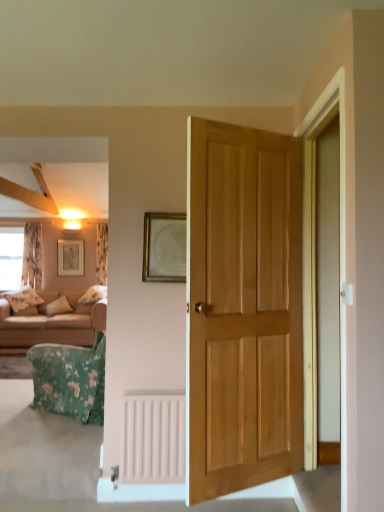
Question: Does matte gold picture frame at upper left, the second picture frame when ordered from right to left, touch beige fabric couch at left?

Choices:
 (A) yes
 (B) no

Answer: (B)

Question: Considering the relative sizes of matte gold picture frame at upper left, which ranks as the 1th picture frame in back-to-front order, and beige fabric couch at left in the image provided, is matte gold picture frame at upper left, which ranks as the 1th picture frame in back-to-front order, thinner than beige fabric couch at left?

Choices:
 (A) no
 (B) yes

Answer: (B)

Question: Can you confirm if matte gold picture frame at upper left, the second picture frame when ordered from right to left, is smaller than beige fabric couch at left?

Choices:
 (A) no
 (B) yes

Answer: (B)

Question: Is there a large distance between matte gold picture frame at upper left, the second picture frame from the front, and beige fabric couch at left?

Choices:
 (A) no
 (B) yes

Answer: (B)

Question: Is matte gold picture frame at upper left, the second picture frame when ordered from right to left, positioned before beige fabric couch at left?

Choices:
 (A) yes
 (B) no

Answer: (B)

Question: From the image's perspective, does matte gold picture frame at upper left, which is counted as the first picture frame, starting from the left, appear higher than beige fabric couch at left?

Choices:
 (A) yes
 (B) no

Answer: (A)

Question: Would you consider floral fabric curtain at left, the second curtain when ordered from left to right, to be distant from gold metallic picture frame at center, which is the first picture frame from right to left?

Choices:
 (A) yes
 (B) no

Answer: (A)

Question: Is floral fabric curtain at left, the second curtain when ordered from left to right, oriented away from gold metallic picture frame at center, the 2th picture frame when ordered from left to right?

Choices:
 (A) no
 (B) yes

Answer: (A)

Question: Does floral fabric curtain at left, which is the 1th curtain from right to left, appear on the right side of gold metallic picture frame at center, which is counted as the first picture frame, starting from the front?

Choices:
 (A) no
 (B) yes

Answer: (A)

Question: Does floral fabric curtain at left, which is the 1th curtain from right to left, lie behind gold metallic picture frame at center, which ranks as the second picture frame in back-to-front order?

Choices:
 (A) yes
 (B) no

Answer: (A)

Question: From a real-world perspective, is floral fabric curtain at left, which is the 1th curtain from right to left, beneath gold metallic picture frame at center, which ranks as the second picture frame in back-to-front order?

Choices:
 (A) yes
 (B) no

Answer: (B)

Question: Can you confirm if floral fabric curtain at left, which is the 1th curtain from right to left, is shorter than gold metallic picture frame at center, which ranks as the second picture frame in back-to-front order?

Choices:
 (A) no
 (B) yes

Answer: (A)

Question: From the image's perspective, is beige fabric couch at left above floral fabric curtain at left, the second curtain when ordered from left to right?

Choices:
 (A) no
 (B) yes

Answer: (A)